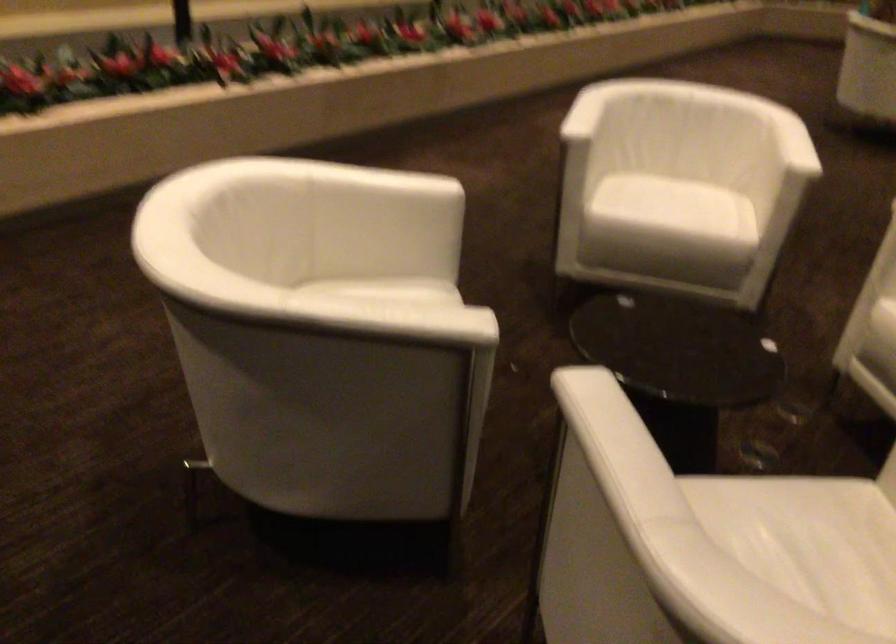
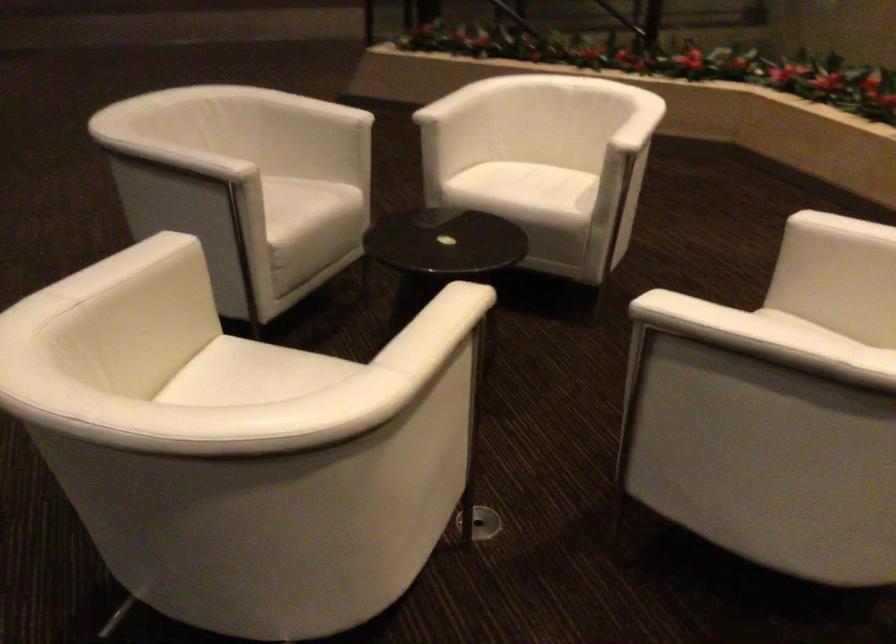
In the second image, find the point that corresponds to [280,290] in the first image.

(469, 89)